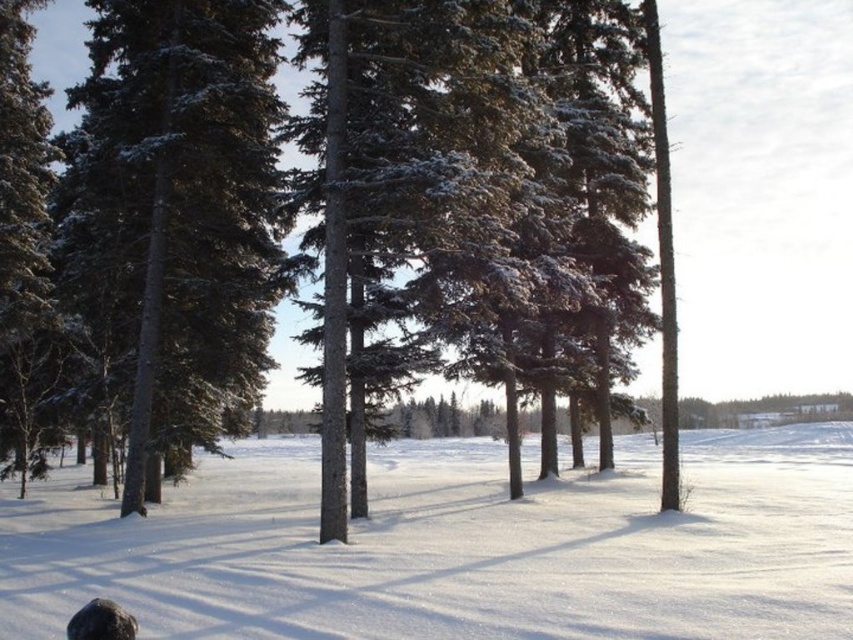
You are an observer standing in the snowy field. You see the white powdery snow at center and the green textured pine tree at left. Which object is closer to you?

The white powdery snow at center is closer to you because it is in front of the green textured pine tree at left.

You are standing at the point marked as point [457,547] in the winter landscape. What is the substance you are currently standing on?

The substance at point [457,547] is white powdery snow at center.